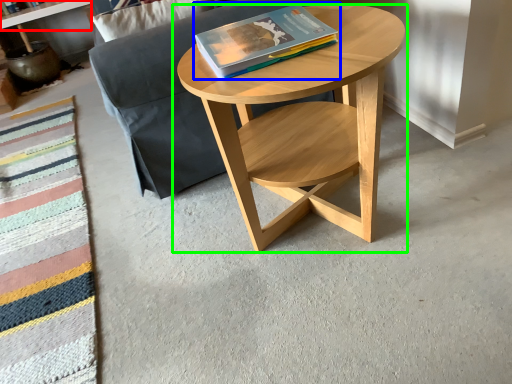
Question: Which is farther away from shelf (highlighted by a red box)? book (highlighted by a blue box) or coffee table (highlighted by a green box)?

Choices:
 (A) book
 (B) coffee table

Answer: (B)